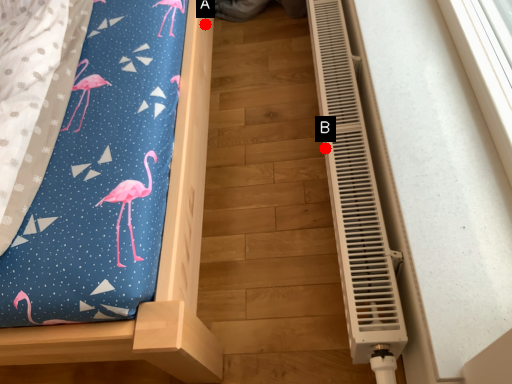
Question: Two points are circled on the image, labeled by A and B beside each circle. Which of the following is the farthest from the observer?

Choices:
 (A) A is further
 (B) B is further

Answer: (A)